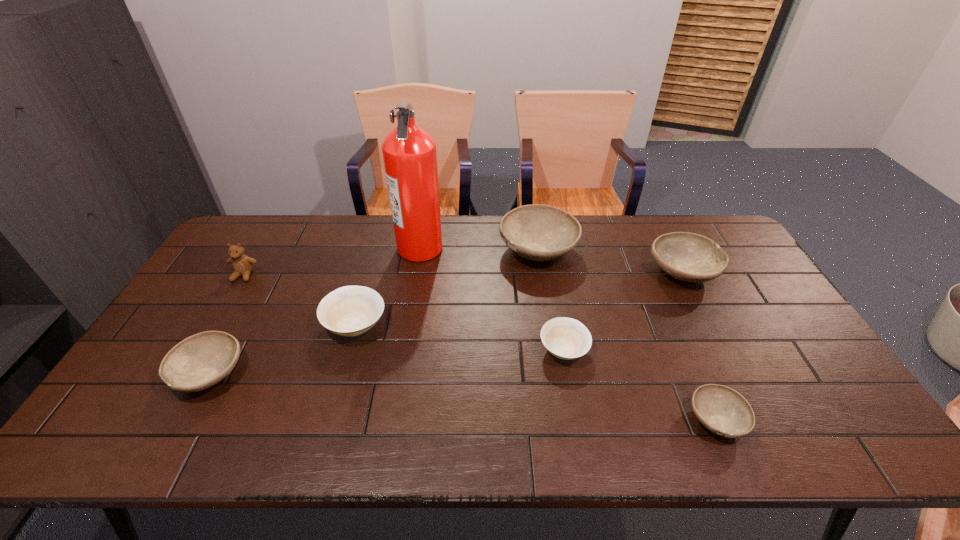
This screenshot has width=960, height=540. Find the location of `object that is at the near edge`. object that is at the near edge is located at coordinates (722, 410).

You are a GUI agent. You are given a task and a screenshot of the screen. Output one action in this format:
    pyautogui.click(x=<x>, y=<y>)
    Task: Click on the teddy bear located in the left edge section of the desktop
    The width and height of the screenshot is (960, 540).
    Given the screenshot: What is the action you would take?
    pyautogui.click(x=242, y=265)

Where is `bowl that is at the left edge`? Image resolution: width=960 pixels, height=540 pixels. bowl that is at the left edge is located at coordinates (200, 361).

I want to click on object located in the right edge section of the desktop, so click(689, 257).

This screenshot has height=540, width=960. I want to click on object located at the far right corner, so click(x=689, y=257).

Where is `vacant space at the far edge of the desktop`? vacant space at the far edge of the desktop is located at coordinates (310, 255).

Where is `vacant region at the near edge of the desktop`? The image size is (960, 540). vacant region at the near edge of the desktop is located at coordinates (626, 452).

Locate an element on the screen. The width and height of the screenshot is (960, 540). free space at the right edge of the desktop is located at coordinates (789, 383).

In the image, there is a desktop. Where is `blank space at the far right corner`? This screenshot has width=960, height=540. blank space at the far right corner is located at coordinates (684, 221).

I want to click on free spot between the leftmost bowl and the smaller beige bowl, so click(x=387, y=362).